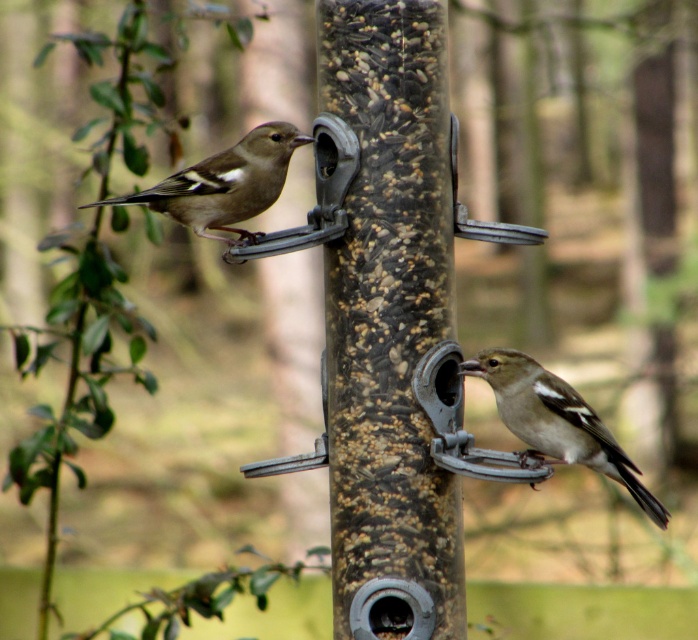
Based on the photo, you are a birdwatcher observing the two birds on the bird feeder. Which bird takes up more space on the feeder, the brown speckled sparrow at lower right or the brown speckled feathers at upper left?

The brown speckled feathers at upper left takes up more space on the feeder than the brown speckled sparrow at lower right.

You are a birdwatcher trying to identify the birds in the image. Which bird is positioned closer to the camera, the brown speckled sparrow at lower right or the brown speckled feathers at upper left?

The brown speckled sparrow at lower right is closer to the viewer than the brown speckled feathers at upper left.